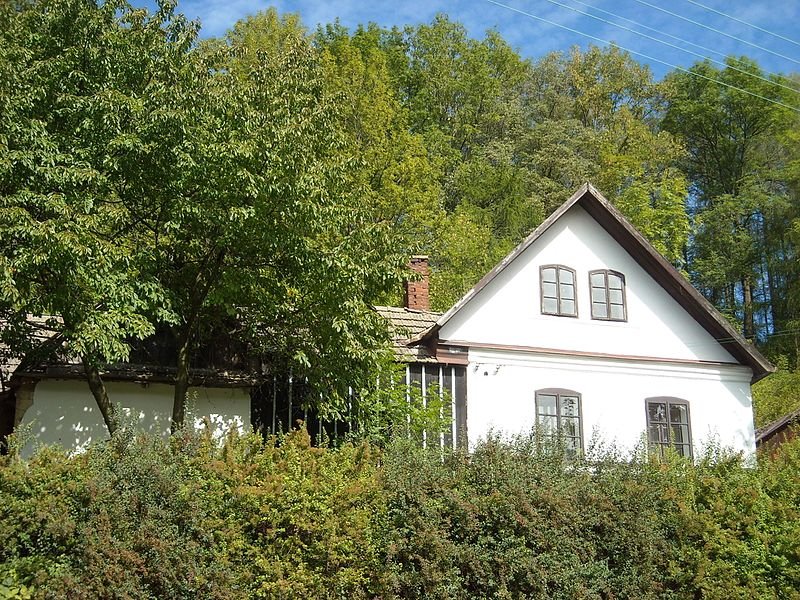
The width and height of the screenshot is (800, 600). In order to click on chimney in this screenshot , I will do 417,290.